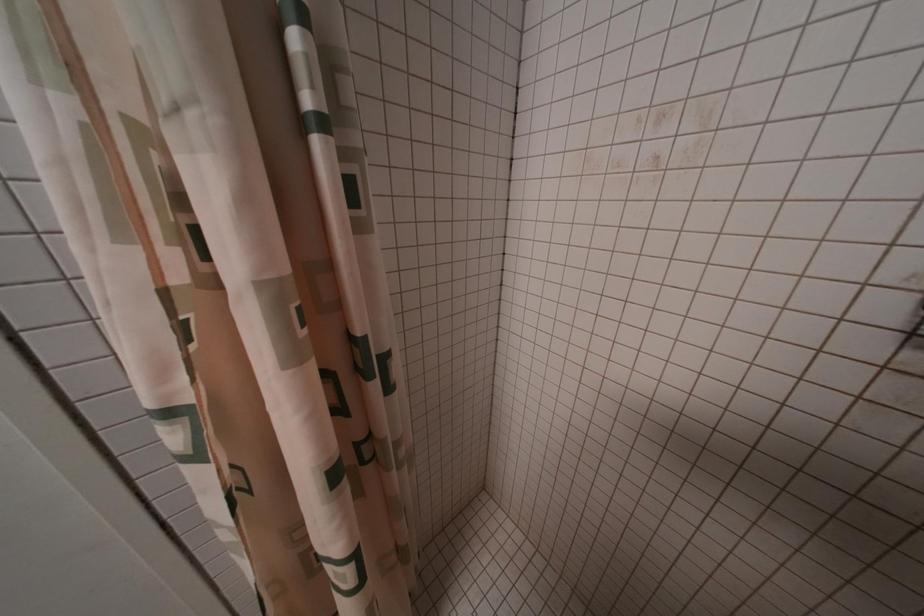
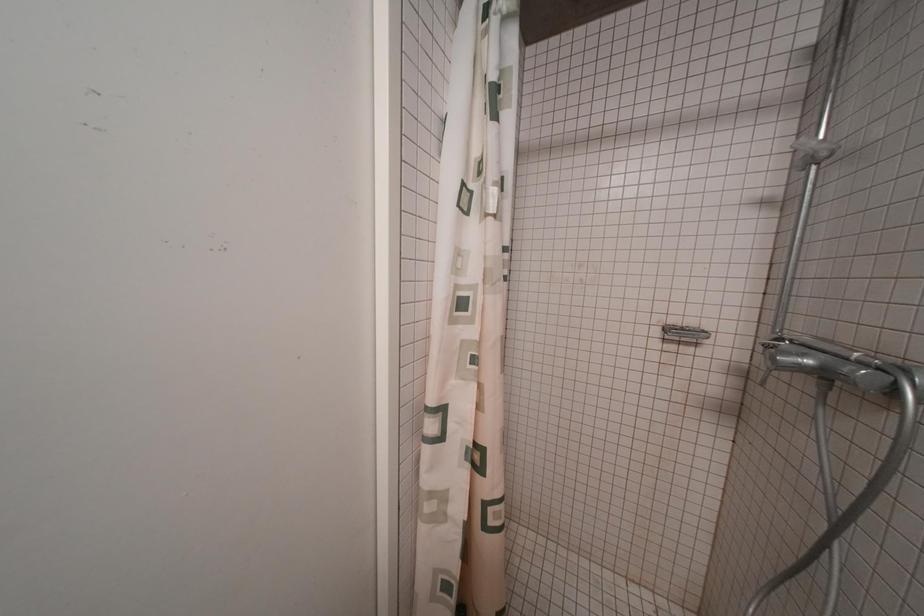
Question: Based on the continuous images, in which direction is the camera rotating? Reply with the corresponding letter.

Choices:
 (A) Left
 (B) Right
 (C) Up
 (D) Down

Answer: (B)